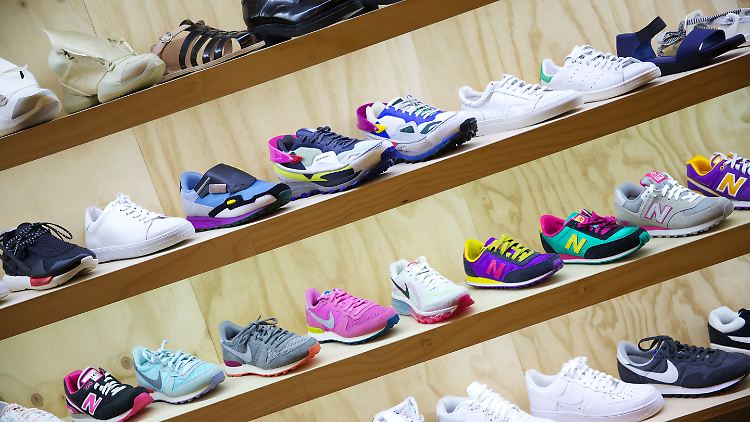
The image size is (750, 422). I want to click on shoes on 2nd shelf, so click(x=55, y=257), click(x=134, y=222), click(x=225, y=189), click(x=338, y=158), click(x=434, y=113), click(x=540, y=105), click(x=600, y=53), click(x=682, y=45), click(x=735, y=15).